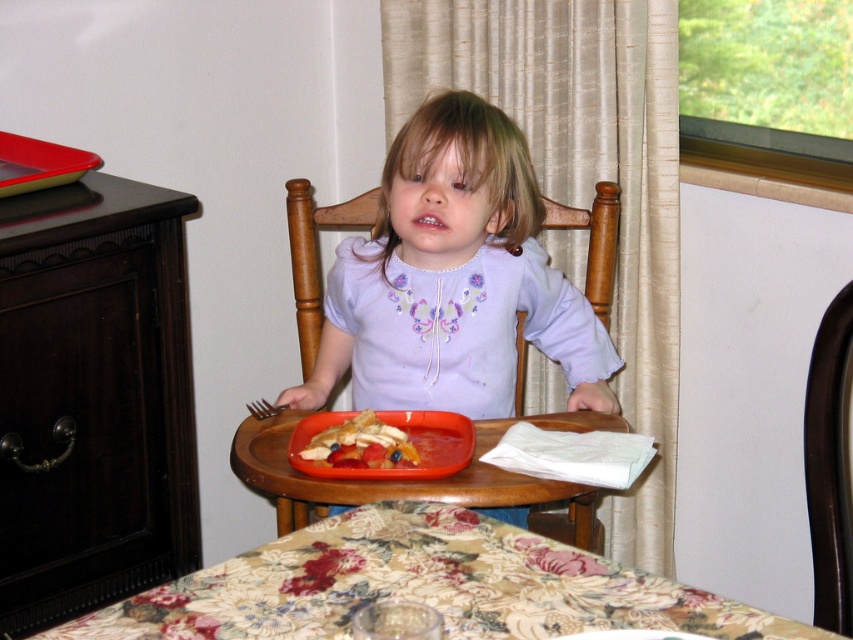
From the picture: Can you confirm if floral fabric table at center is smaller than wooden chair at center?

Yes, floral fabric table at center is smaller than wooden chair at center.

Is point (341, 584) positioned after point (598, 205)?

No, it is not.

Does point (770, 618) lie in front of point (374, 204)?

Yes, it is.

The width and height of the screenshot is (853, 640). Identify the location of floral fabric table at center. [x=421, y=586].

Can you confirm if dark wood dresser at left is taller than wooden tray at center?

Correct, dark wood dresser at left is much taller as wooden tray at center.

Who is more forward, [57,419] or [502,429]?

Point [502,429] is in front.

You are a GUI agent. You are given a task and a screenshot of the screen. Output one action in this format:
    pyautogui.click(x=<x>, y=<y>)
    Task: Click on the dark wood dresser at left
    Image resolution: width=853 pixels, height=640 pixels.
    Given the screenshot: What is the action you would take?
    pyautogui.click(x=93, y=397)

Between dark brown wood chair at center and smooth plastic tray at center, which one appears on the left side from the viewer's perspective?

smooth plastic tray at center

Does dark brown wood chair at center appear on the left side of smooth plastic tray at center?

Incorrect, dark brown wood chair at center is not on the left side of smooth plastic tray at center.

Between point (820, 381) and point (399, 433), which one is positioned in front?

Point (820, 381)

Where is `dark brown wood chair at center`? The height and width of the screenshot is (640, 853). dark brown wood chair at center is located at coordinates (828, 467).